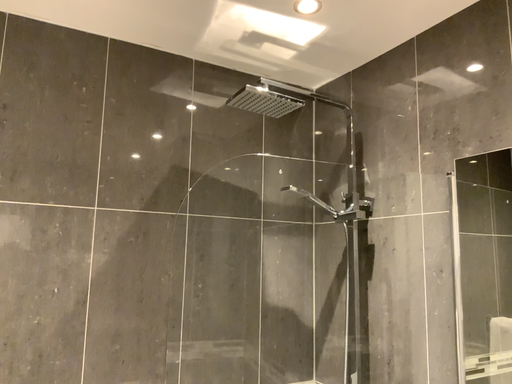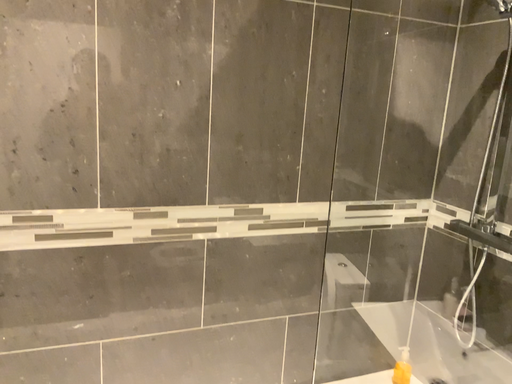
Question: How did the camera likely rotate when shooting the video?

Choices:
 (A) rotated upward
 (B) rotated downward

Answer: (B)